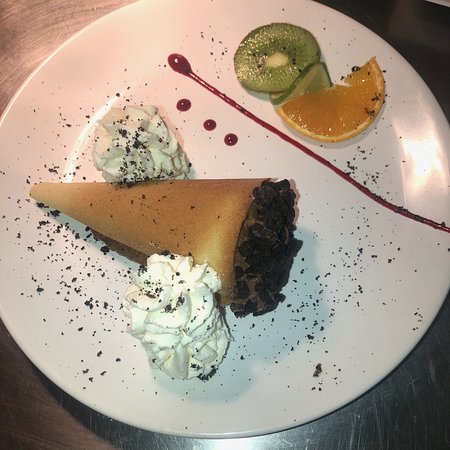
Identify the location of platetabletop. This screenshot has width=450, height=450. (195, 417), (39, 33), (50, 418), (421, 33).